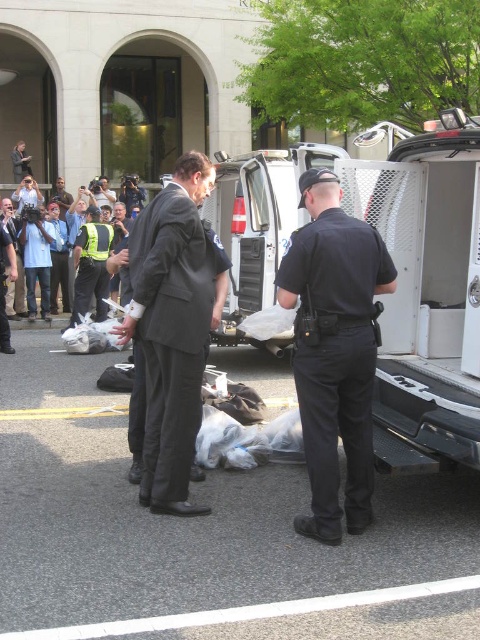
In the scene shown: Between black uniform at center and multicolored fabric crowd at left, which one has more height?

With more height is multicolored fabric crowd at left.

Can you confirm if black uniform at center is taller than multicolored fabric crowd at left?

In fact, black uniform at center may be shorter than multicolored fabric crowd at left.

Image resolution: width=480 pixels, height=640 pixels. I want to click on black uniform at center, so click(x=334, y=349).

Image resolution: width=480 pixels, height=640 pixels. Find the location of `reflective yellow vest at center`. reflective yellow vest at center is located at coordinates (91, 266).

From the picture: Is reflective yellow vest at center above multicolored fabric crowd at left?

No.

Is point (78, 241) closer to viewer compared to point (86, 204)?

Yes, it is.

Identify the location of reflective yellow vest at center. (91, 266).

Can you confirm if dark gray suit at center is positioned to the left of reflective yellow vest at center?

Incorrect, dark gray suit at center is not on the left side of reflective yellow vest at center.

Is dark gray suit at center behind reflective yellow vest at center?

No, it is in front of reflective yellow vest at center.

Does point (162, 228) lie in front of point (105, 243)?

Yes, it is.

Where is `dark gray suit at center`? The image size is (480, 640). dark gray suit at center is located at coordinates (173, 326).